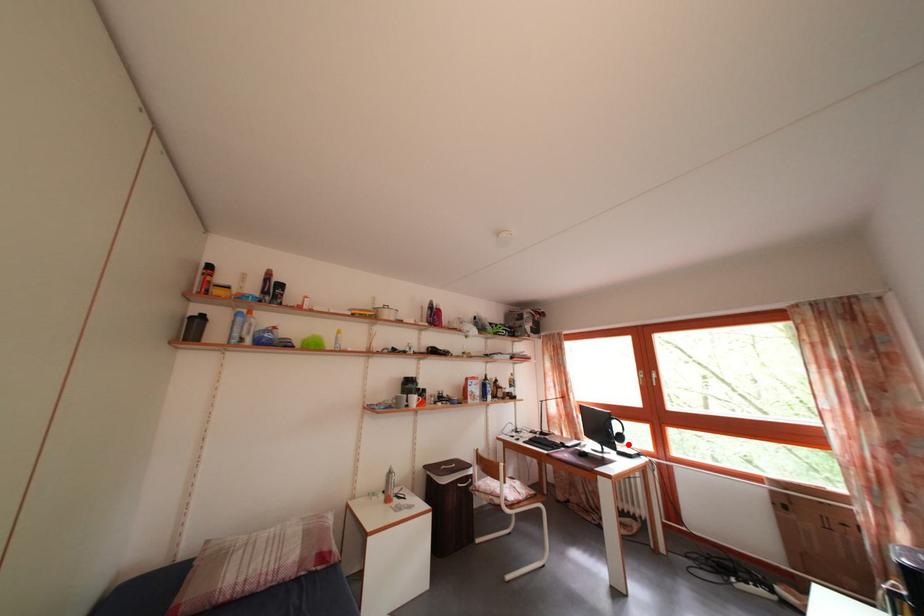
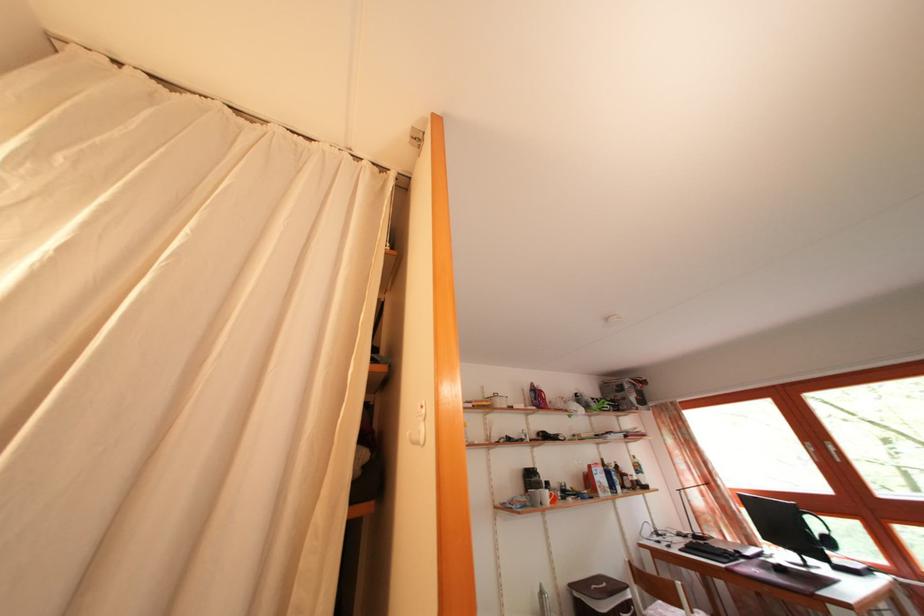
Find the pixel in the second image that matches the highlighted location in the first image.

(837, 549)